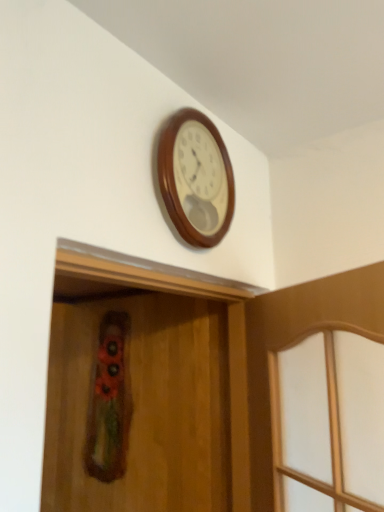
Question: Which is correct: wooden clock at upper center is inside wooden screen door at center, or outside of it?

Choices:
 (A) outside
 (B) inside

Answer: (A)

Question: Considering their positions, is wooden clock at upper center located in front of or behind wooden screen door at center?

Choices:
 (A) behind
 (B) front

Answer: (A)

Question: From the image's perspective, relative to wooden screen door at center, is wooden clock at upper center above or below?

Choices:
 (A) below
 (B) above

Answer: (B)

Question: In the image, is wooden screen door at center on the left side or the right side of wooden clock at upper center?

Choices:
 (A) right
 (B) left

Answer: (B)

Question: In terms of width, does wooden screen door at center look wider or thinner when compared to wooden clock at upper center?

Choices:
 (A) wide
 (B) thin

Answer: (A)

Question: Based on their sizes in the image, would you say wooden screen door at center is bigger or smaller than wooden clock at upper center?

Choices:
 (A) small
 (B) big

Answer: (B)

Question: Considering the positions of point (107, 317) and point (206, 216), is point (107, 317) closer or farther from the camera than point (206, 216)?

Choices:
 (A) closer
 (B) farther

Answer: (B)